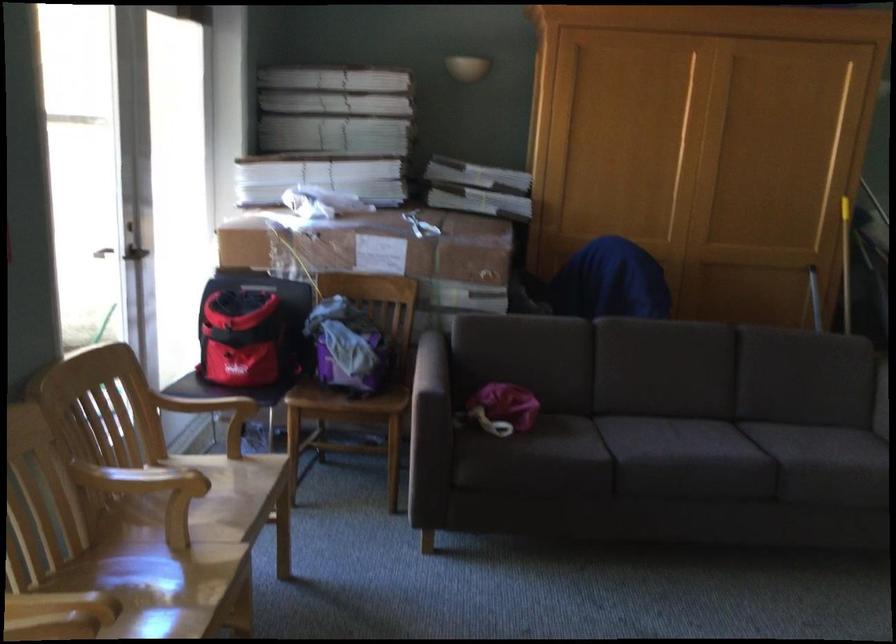
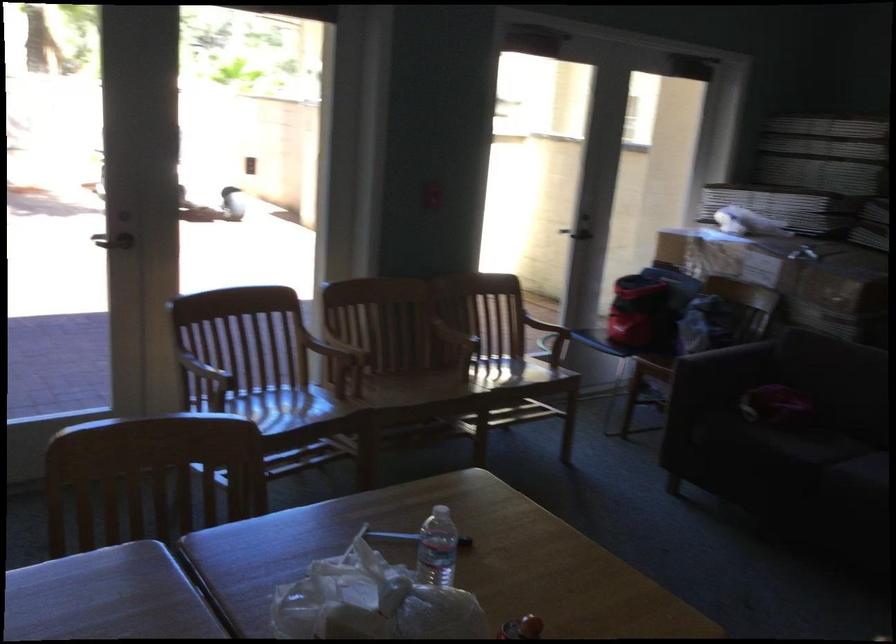
In the second image, find the point that corresponds to pixel 555 379 in the first image.

(843, 392)